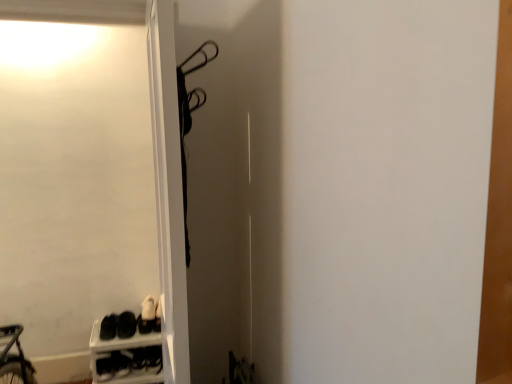
Question: Which is correct: black matte sneakers at lower left, the third footwear positioned from the left, is inside white leather shoe at lower left, or outside of it?

Choices:
 (A) inside
 (B) outside

Answer: (B)

Question: Is point (156, 309) positioned closer to the camera than point (160, 367)?

Choices:
 (A) farther
 (B) closer

Answer: (A)

Question: Estimate the real-world distances between objects in this image. Which object is farther from the white leather shoe at lower left?

Choices:
 (A) white plastic shoe rack at lower left
 (B) black matte shoes at lower left, the first footwear in the left-to-right sequence
 (C) black matte sneakers at lower left, arranged as the 2th footwear when viewed from the right
 (D) white matte screen door at upper left
 (E) black matte sneakers at lower left, the third footwear positioned from the left

Answer: (D)

Question: Considering the real-world distances, which object is closest to the white leather shoe at lower left?

Choices:
 (A) black matte sneakers at lower left, arranged as the 2th footwear when viewed from the right
 (B) white plastic shoe rack at lower left
 (C) black matte sneakers at lower left, which is the first footwear from right to left
 (D) white matte screen door at upper left
 (E) black matte shoes at lower left, the 3th footwear when ordered from right to left

Answer: (B)